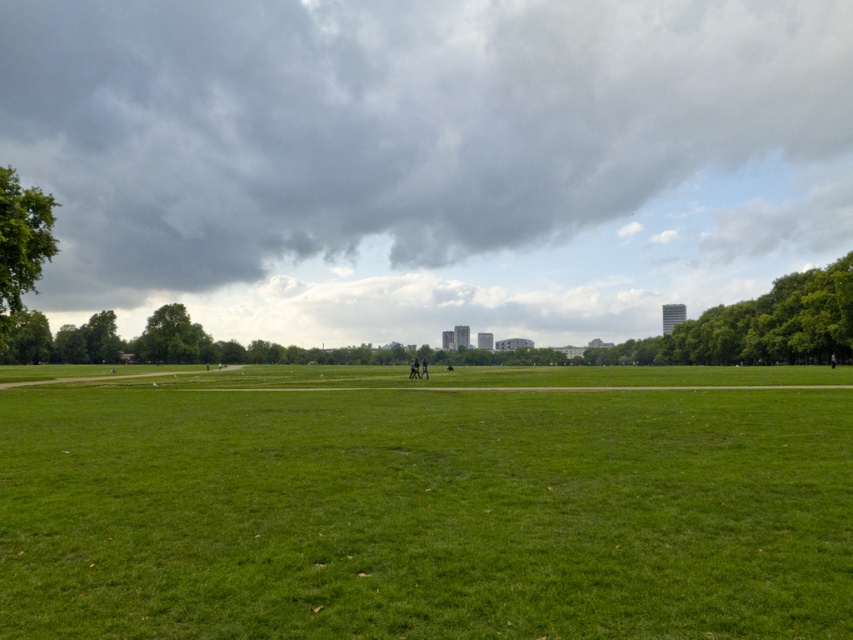
You are standing at the center of the field and want to reach the green leafy tree at right. Which direction should you walk?

You should walk towards the right direction to reach the green leafy tree at right.

You are standing at the camera position and want to walk towards the two points marked in the image. Which point will you reach first, point (30, 209) or point (161, 346)?

Point (30, 209) is closer to the camera than point (161, 346), so you will reach point (30, 209) first.

You are planning to fly a kite in the open grassy field. You see the dark gray cloud at upper center and the green leafy tree at right. Which object is taller from your perspective?

The dark gray cloud at upper center is taller than the green leafy tree at right.